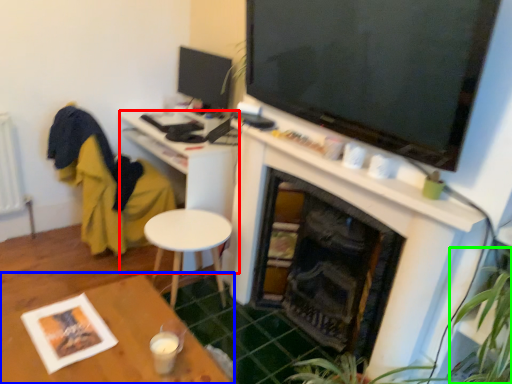
Question: Estimate the real-world distances between objects in this image. Which object is closer to desk (highlighted by a red box), table (highlighted by a blue box) or plant (highlighted by a green box)?

Choices:
 (A) table
 (B) plant

Answer: (A)